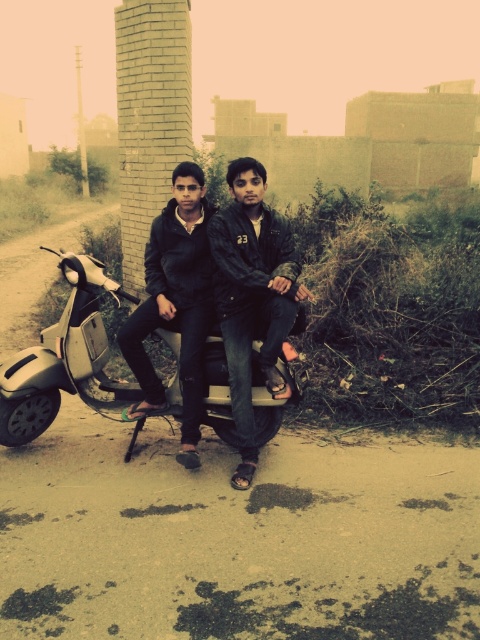
Is point (252, 456) positioned after point (56, 339)?

No, (252, 456) is closer to viewer.

Which is below, dark blue jeans at center or metallic silver scooter at center?

metallic silver scooter at center is lower down.

Find the location of a particular element. dark blue jeans at center is located at coordinates (216, 292).

Image resolution: width=480 pixels, height=640 pixels. What are the coordinates of `dark blue jeans at center` in the screenshot? It's located at (216, 292).